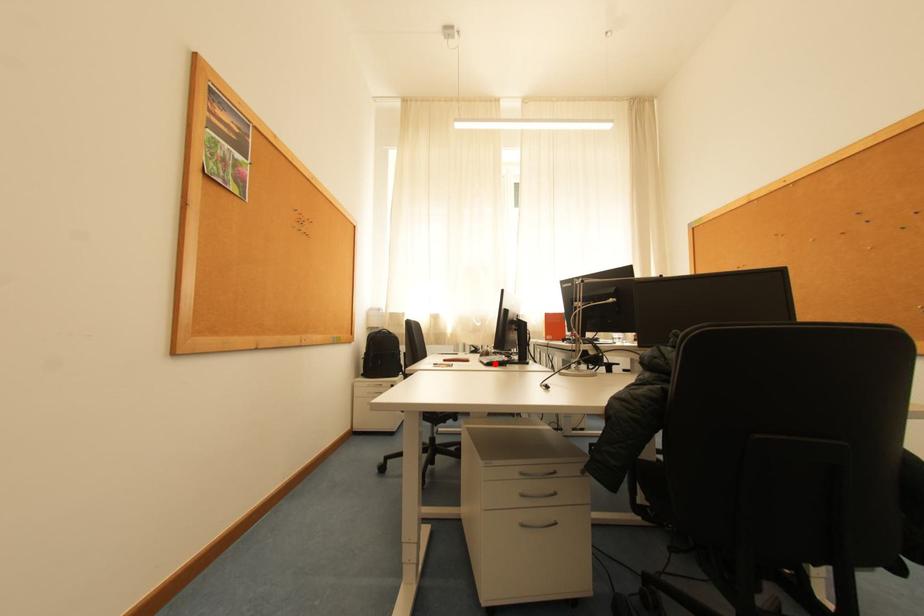
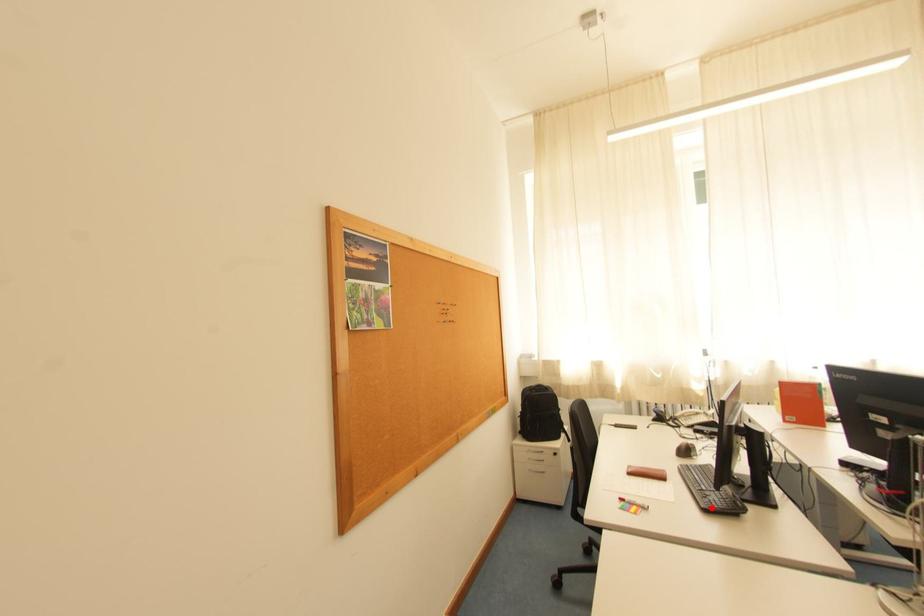
From the picture: I am providing you with two images of the same scene from different viewpoints. A red point is marked on the first image and another point is marked on the second image. Is the red point in image1 aligned with the point shown in image2?

Yes